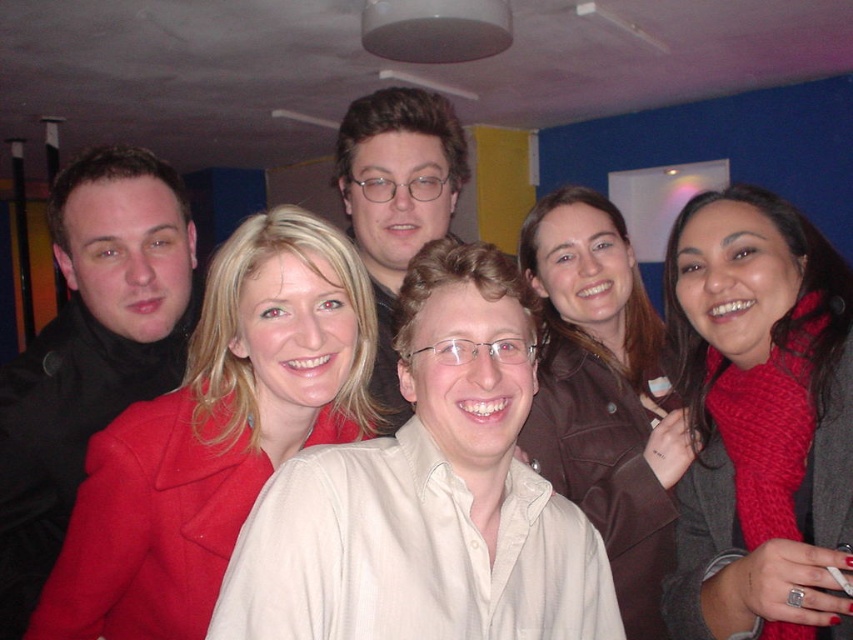
Question: Does brown leather jacket at upper center appear under glossy black hair at center?

Choices:
 (A) no
 (B) yes

Answer: (B)

Question: Estimate the real-world distances between objects in this image. Which object is closer to the white matte shirt at center?

Choices:
 (A) knitted red scarf at right
 (B) brown leather jacket at upper center
 (C) matte red coat at left

Answer: (C)

Question: Can you confirm if matte red coat at left is positioned below brown leather jacket at upper center?

Choices:
 (A) yes
 (B) no

Answer: (A)

Question: Does knitted red scarf at right appear over matte black jacket at left?

Choices:
 (A) no
 (B) yes

Answer: (A)

Question: Which object is positioned closest to the glossy black hair at center?

Choices:
 (A) brown leather jacket at upper center
 (B) matte red coat at left

Answer: (B)

Question: Among these points, which one is nearest to the camera?

Choices:
 (A) (572, 410)
 (B) (689, 545)
 (C) (303, 326)

Answer: (C)